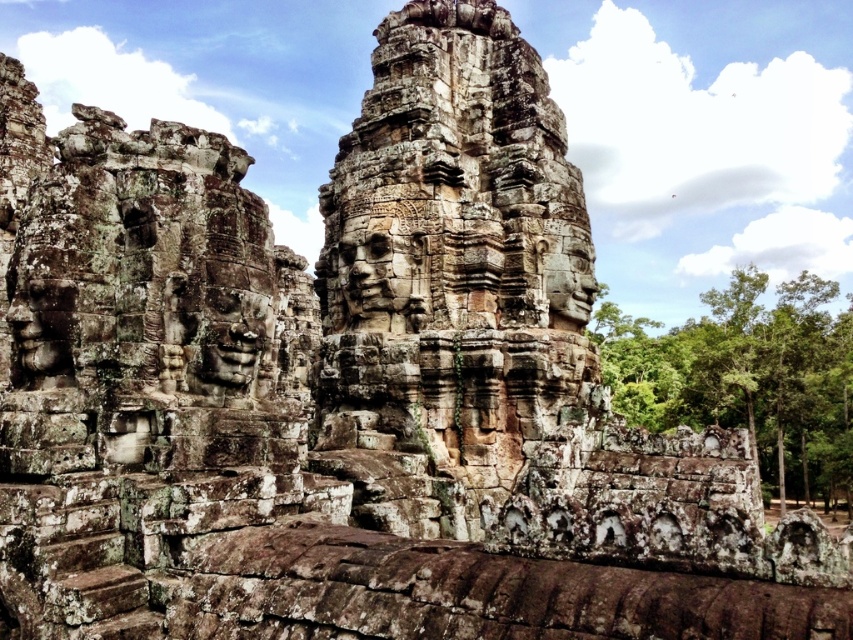
How much distance is there between rough stone face at center and rustic stone face at center?

rough stone face at center is 18.86 meters away from rustic stone face at center.

Does rough stone face at center have a larger size compared to rustic stone face at center?

Incorrect, rough stone face at center is not larger than rustic stone face at center.

The width and height of the screenshot is (853, 640). Describe the element at coordinates (228, 326) in the screenshot. I see `rough stone face at center` at that location.

This screenshot has width=853, height=640. What are the coordinates of `rough stone face at center` in the screenshot? It's located at (228, 326).